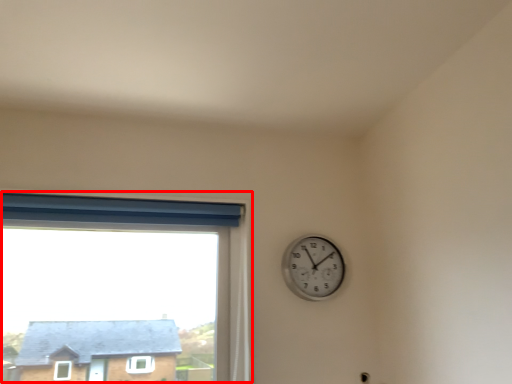
Question: From the image, what is the correct spatial relationship of window (annotated by the red box) in relation to wall clock?

Choices:
 (A) left
 (B) right

Answer: (A)